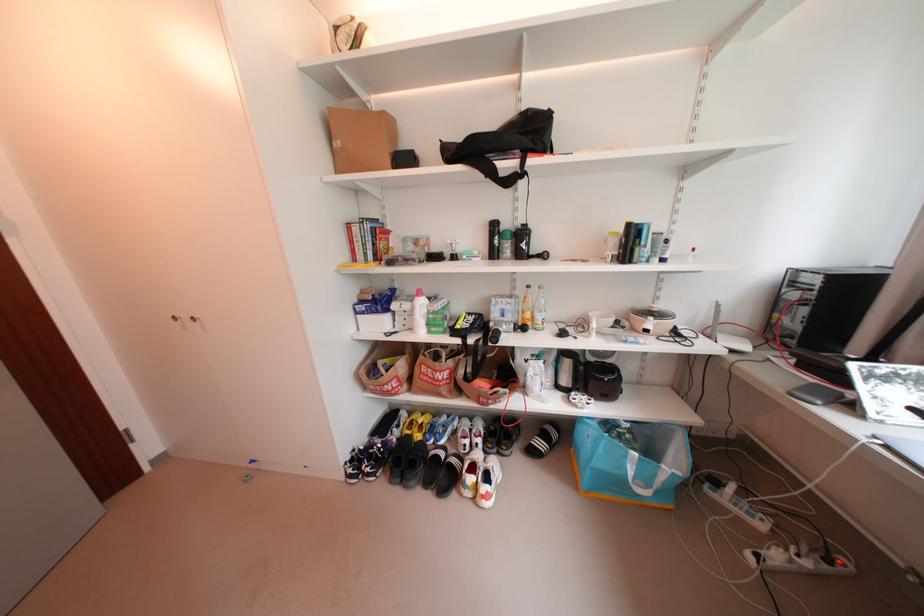
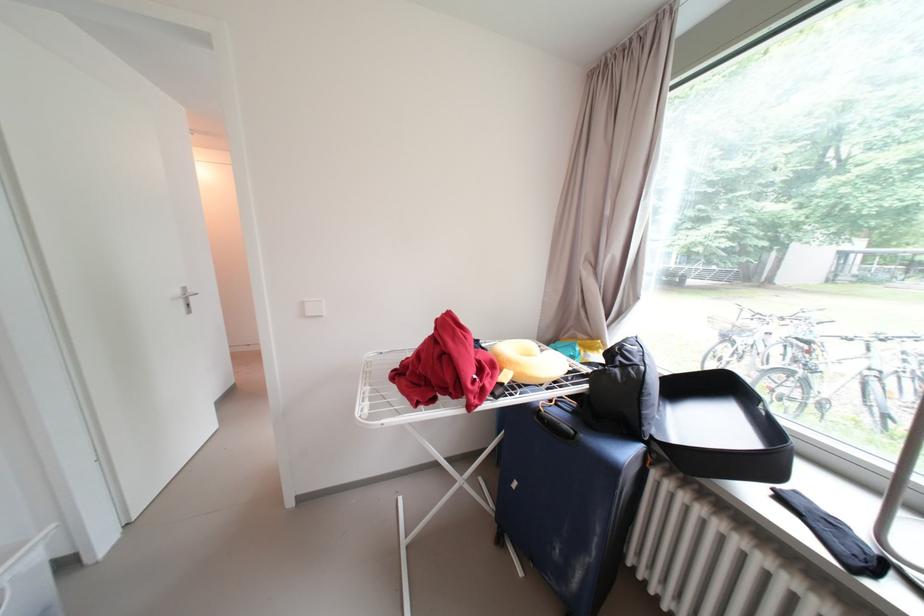
Question: I am providing you with two images of the same scene from different viewpoints. Which of the following objects are not visible in image2?

Choices:
 (A) black glove
 (B) yellow neck pillow
 (C) shelf file binder
 (D) black slide sandal

Answer: (D)